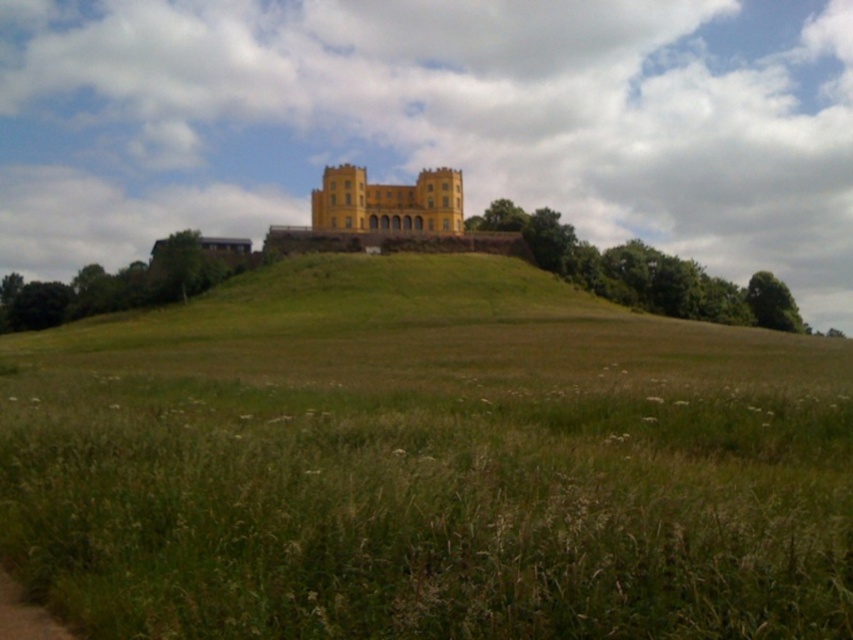
You are a hiker standing at the end of the brown dirt path at lower left, looking towards the yellow matte building at center. Which direction should you walk to reach the building?

The yellow matte building at center is positioned over the brown dirt path at lower left, so you should walk straight ahead along the path to reach the building.

You are standing at the base of the hill and want to reach the castle on top. You have two options to climb up the hill. One path is the green grassy hill at upper center, and the other is the brown dirt path at lower left. Which path is wider and more suitable for climbing?

The green grassy hill at upper center is larger in size than the brown dirt path at lower left, so it is wider and more suitable for climbing.

You are standing in front of the yellow castle structure and want to place a small garden ornament. Where exactly should you place it to ensure it aligns with the green grassy hill at upper center?

The green grassy hill at upper center is located at point (426, 465), so you should place the garden ornament at that coordinate to align with it.